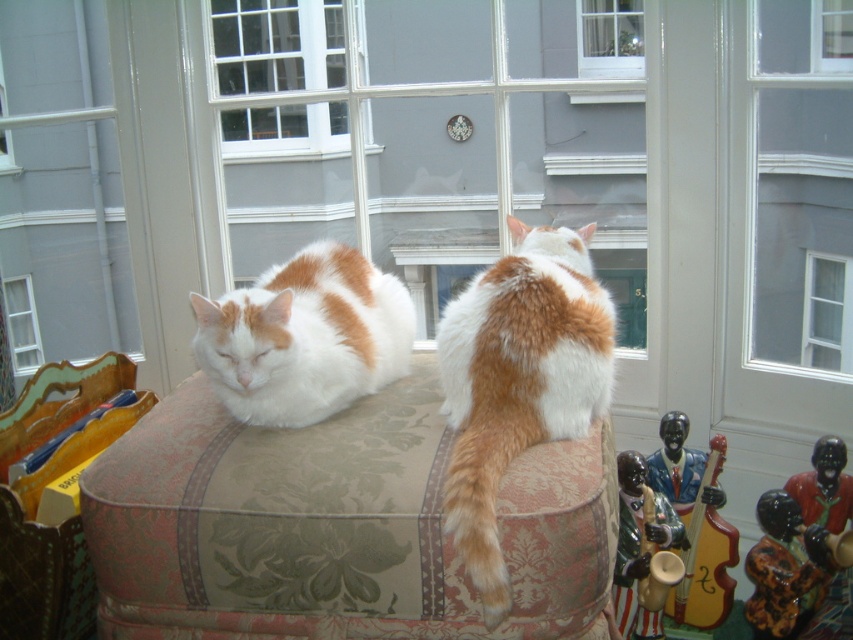
In the scene shown: Is transparent glass window at center further to the viewer compared to white fluffy cat at center?

That is True.

Between point (506, 28) and point (244, 362), which one is positioned in front?

Positioned in front is point (244, 362).

This screenshot has height=640, width=853. What are the coordinates of `transparent glass window at center` in the screenshot? It's located at (424, 140).

The height and width of the screenshot is (640, 853). In order to click on patterned fabric chair at lower left in this screenshot , I will do `click(45, 483)`.

Can you confirm if patterned fabric chair at lower left is thinner than clear glass window at center?

No.

Does point (57, 436) lie behind point (816, 305)?

That is False.

Locate an element on the screen. patterned fabric chair at lower left is located at coordinates (45, 483).

This screenshot has width=853, height=640. What are the coordinates of `orange and white fur at upper center` in the screenshot? It's located at (518, 380).

Is point (502, 611) farther from viewer compared to point (682, 448)?

No, it is in front of (682, 448).

Identify the location of orange and white fur at upper center. The width and height of the screenshot is (853, 640). [518, 380].